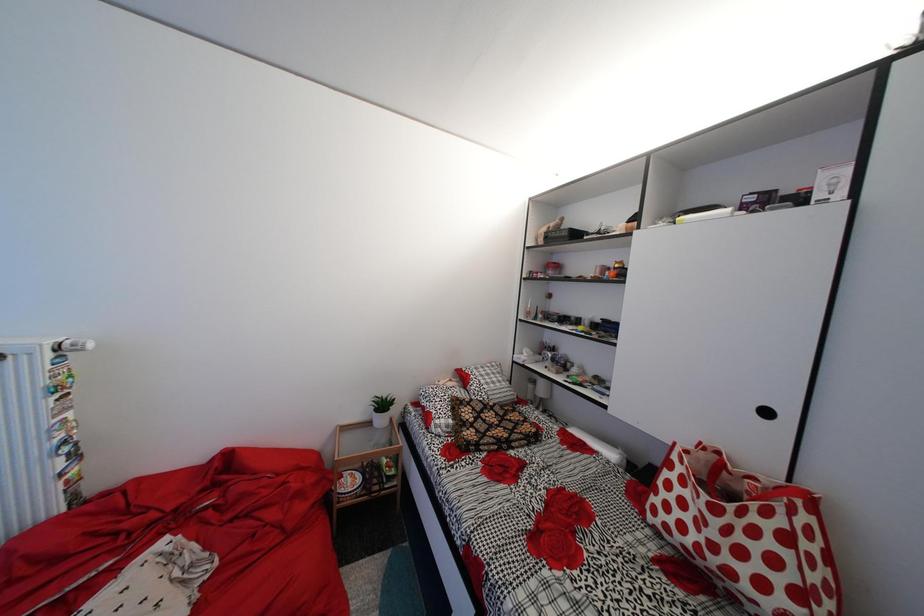
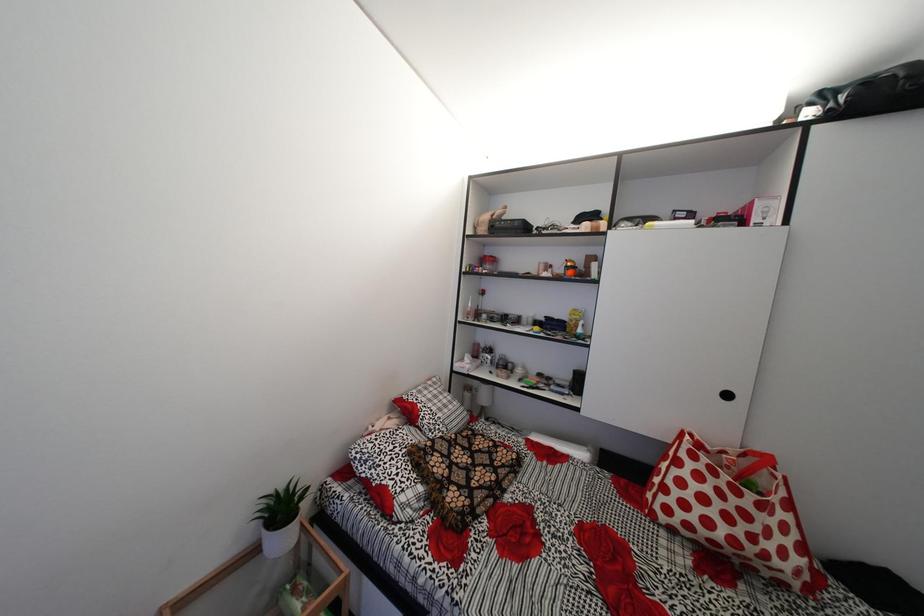
Question: The camera is either moving clockwise (left) or counter-clockwise (right) around the object. The first image is from the beginning of the video and the second image is from the end. Is the camera moving left or right when shooting the video?

Choices:
 (A) Left
 (B) Right

Answer: (A)